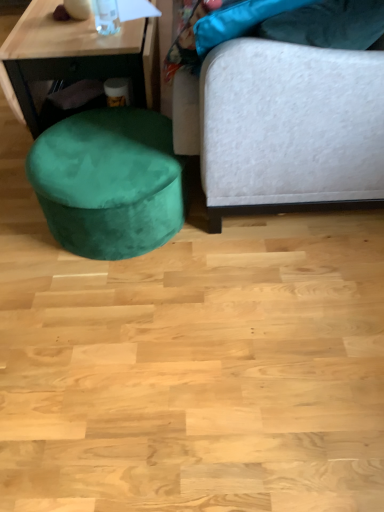
Question: Considering their positions, is transparent glass bottle at upper left located in front of or behind velvet green ottoman at lower left?

Choices:
 (A) front
 (B) behind

Answer: (A)

Question: In terms of width, does transparent glass bottle at upper left look wider or thinner when compared to velvet green ottoman at lower left?

Choices:
 (A) wide
 (B) thin

Answer: (B)

Question: Which object is the closest to the velvet green ottoman at lower left?

Choices:
 (A) velvet white studio couch at right
 (B) transparent glass bottle at upper left
 (C) velvet green ottoman at lower left

Answer: (B)

Question: Considering the real-world distances, which object is closest to the velvet green ottoman at lower left?

Choices:
 (A) transparent glass bottle at upper left
 (B) velvet white studio couch at right
 (C) velvet green ottoman at lower left

Answer: (B)